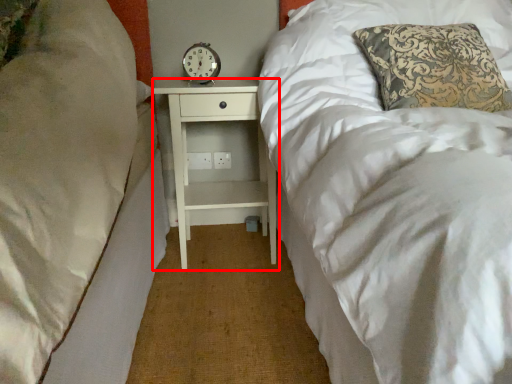
Question: From the image, what is the correct spatial relationship of nightstand (annotated by the red box) in relation to clock?

Choices:
 (A) right
 (B) left

Answer: (A)